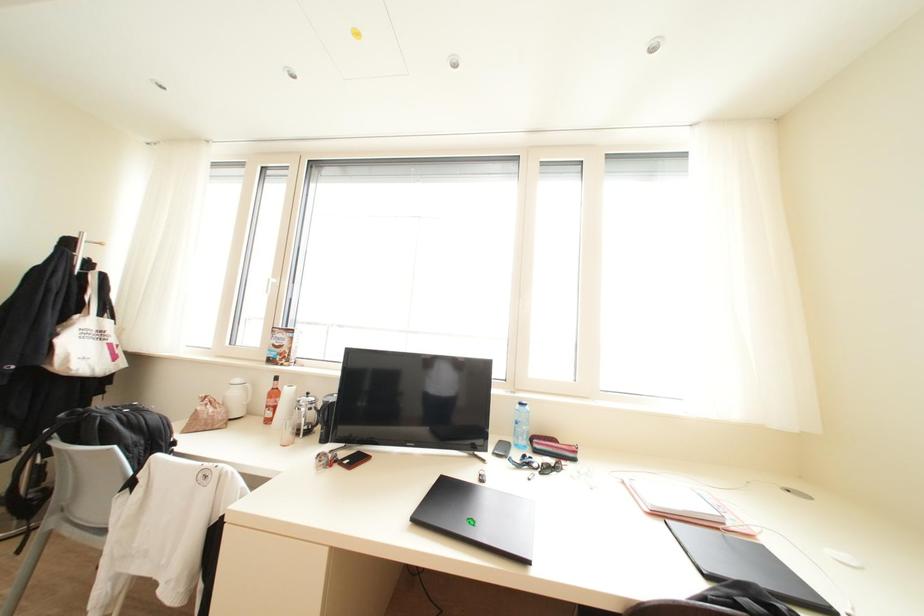
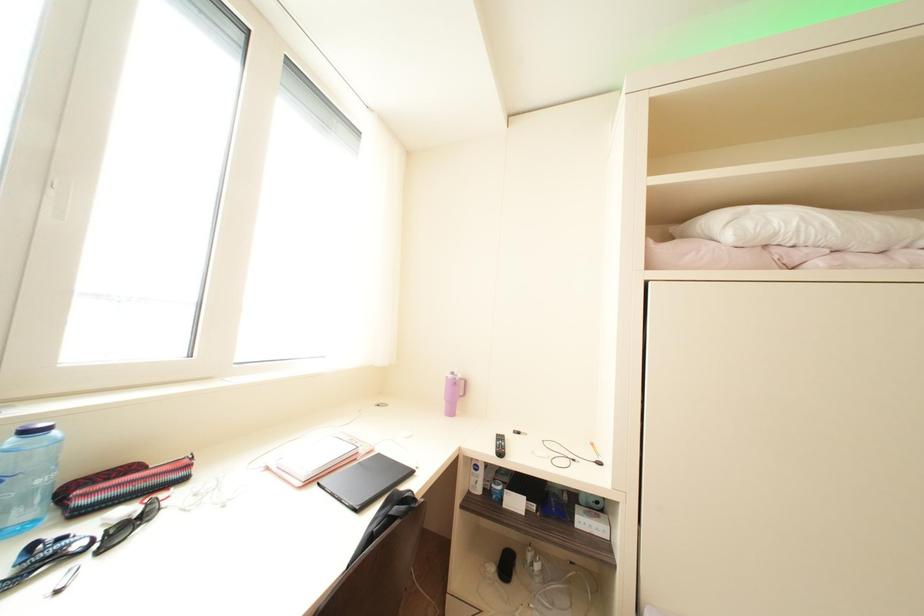
Question: The camera is either moving clockwise (left) or counter-clockwise (right) around the object. The first image is from the beginning of the video and the second image is from the end. Is the camera moving left or right when shooting the video?

Choices:
 (A) Left
 (B) Right

Answer: (A)